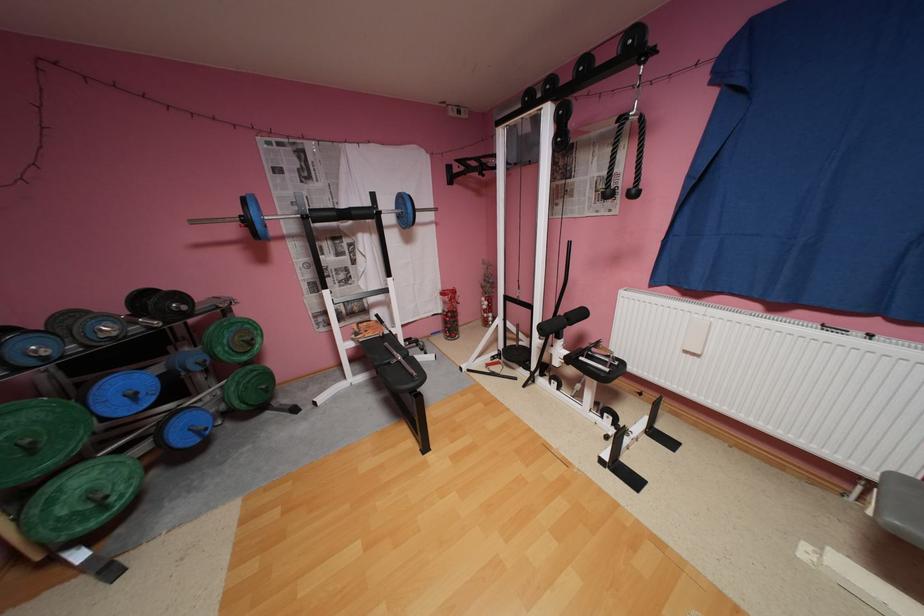
The image size is (924, 616). Find the location of `bench sitting surface`. bench sitting surface is located at coordinates (396, 375).